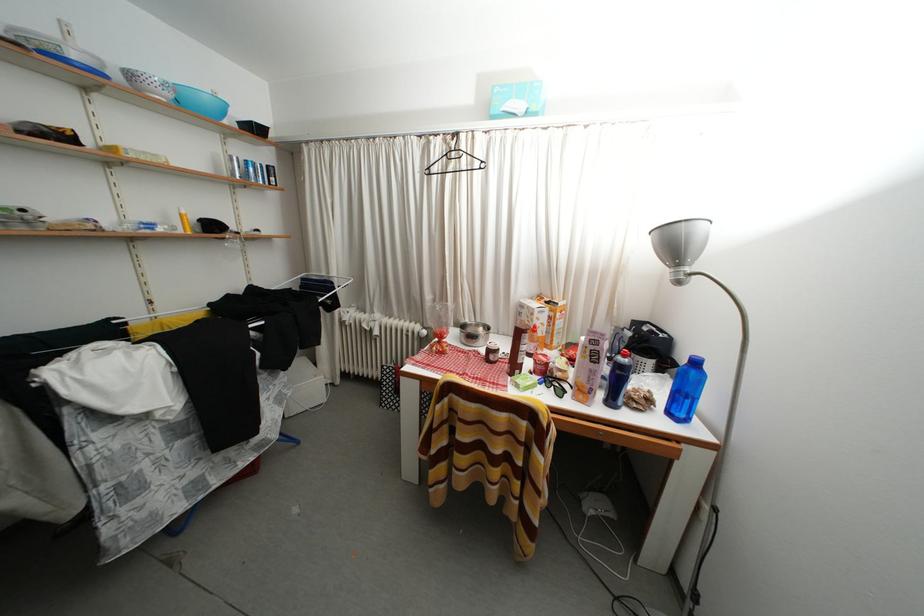
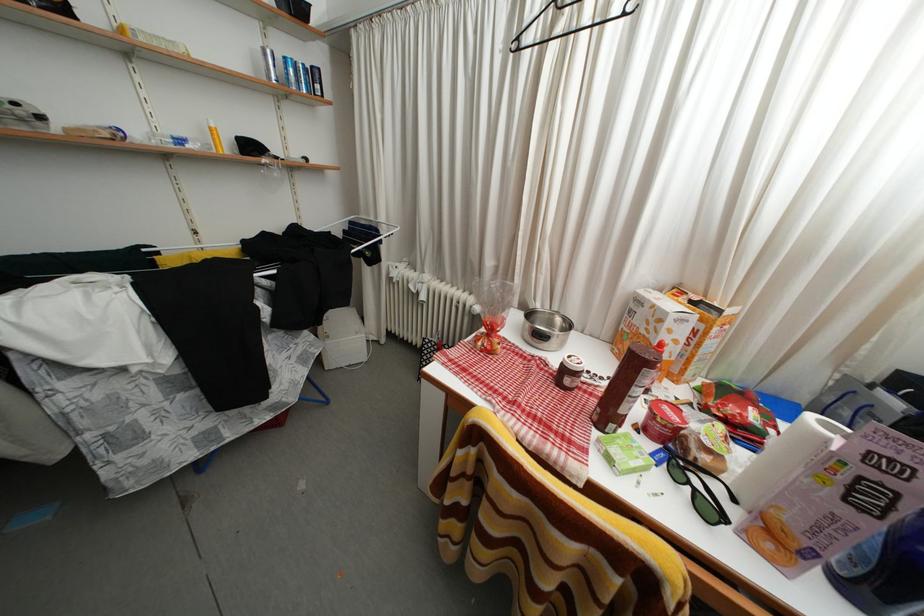
Question: Based on the continuous images, in which direction is the camera rotating? Reply with the corresponding letter.

Choices:
 (A) Left
 (B) Right
 (C) Up
 (D) Down

Answer: (A)